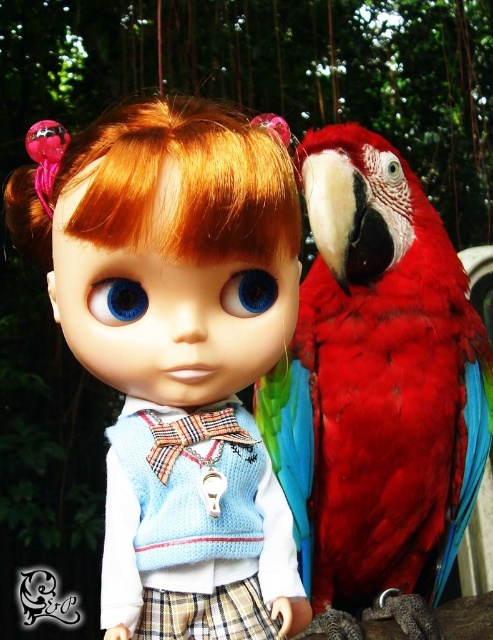
You are a photographer trying to capture the shiny red parrot at right in focus while keeping the matte blue knitted vest at center visible in the background. Is the parrot positioned in front of or behind the vest?

The matte blue knitted vest at center is in front of the shiny red parrot at right, so the parrot is behind the vest. To focus on the parrot, you might need to adjust your angle or depth of field to ensure it isn